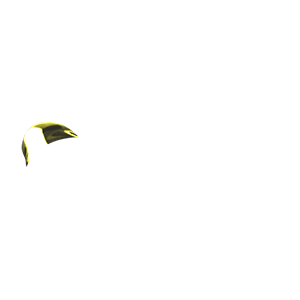
Where is `corner`? Image resolution: width=300 pixels, height=300 pixels. corner is located at coordinates (36, 232).